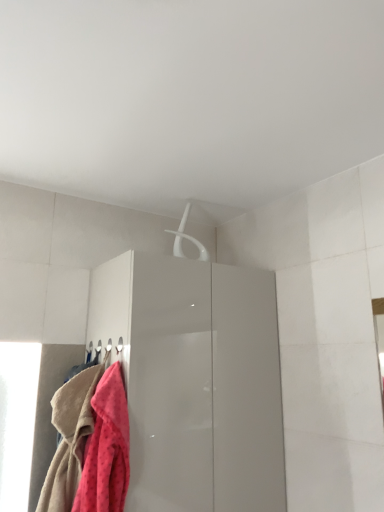
Question: From a real-world perspective, is white plastic hanger at upper center physically above fluffy pink towel at lower left, arranged as the 1th towel when viewed from the left?

Choices:
 (A) yes
 (B) no

Answer: (A)

Question: Would you consider white plastic hanger at upper center to be distant from fluffy pink towel at lower left, which is counted as the second towel, starting from the right?

Choices:
 (A) no
 (B) yes

Answer: (A)

Question: From the image's perspective, is white plastic hanger at upper center beneath fluffy pink towel at lower left, arranged as the 1th towel when viewed from the left?

Choices:
 (A) no
 (B) yes

Answer: (A)

Question: Can you confirm if white plastic hanger at upper center is positioned to the left of fluffy pink towel at lower left, arranged as the 1th towel when viewed from the left?

Choices:
 (A) yes
 (B) no

Answer: (B)

Question: Is white plastic hanger at upper center positioned before fluffy pink towel at lower left, which is counted as the second towel, starting from the right?

Choices:
 (A) no
 (B) yes

Answer: (A)

Question: Is white plastic hanger at upper center oriented away from fluffy pink towel at lower left, arranged as the 1th towel when viewed from the left?

Choices:
 (A) yes
 (B) no

Answer: (B)

Question: Would you consider white plastic hanger at upper center to be distant from glossy white cabinet at center?

Choices:
 (A) yes
 (B) no

Answer: (B)

Question: Is white plastic hanger at upper center facing towards glossy white cabinet at center?

Choices:
 (A) no
 (B) yes

Answer: (A)

Question: Is white plastic hanger at upper center next to glossy white cabinet at center?

Choices:
 (A) yes
 (B) no

Answer: (B)

Question: Considering the relative sizes of white plastic hanger at upper center and glossy white cabinet at center in the image provided, is white plastic hanger at upper center taller than glossy white cabinet at center?

Choices:
 (A) yes
 (B) no

Answer: (B)

Question: Can you confirm if white plastic hanger at upper center is smaller than glossy white cabinet at center?

Choices:
 (A) no
 (B) yes

Answer: (B)

Question: Considering the relative positions of white plastic hanger at upper center and glossy white cabinet at center in the image provided, is white plastic hanger at upper center in front of glossy white cabinet at center?

Choices:
 (A) yes
 (B) no

Answer: (B)

Question: From the image's perspective, does fluffy pink towel at lower left, the first towel from the right, appear lower than glossy white cabinet at center?

Choices:
 (A) yes
 (B) no

Answer: (B)